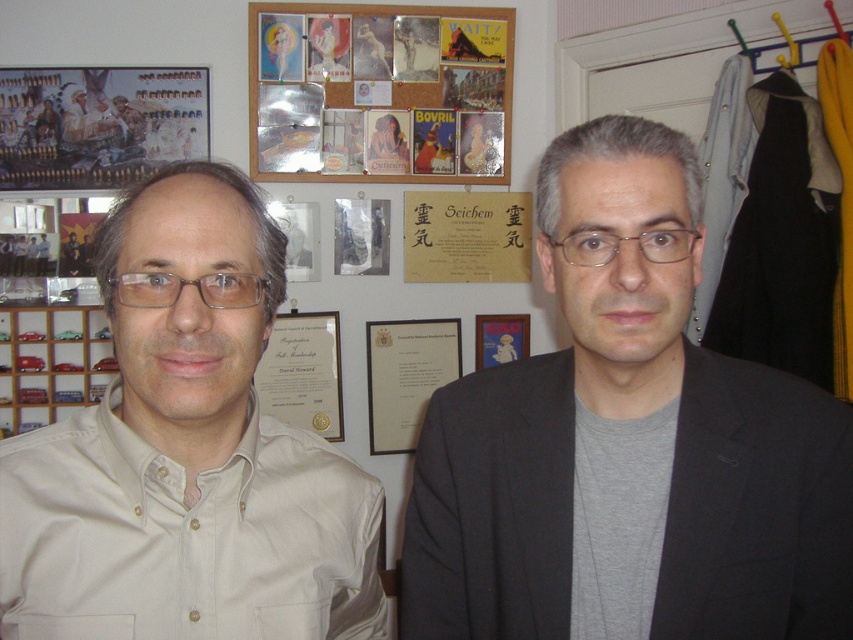
In the scene shown: Please provide the 2D coordinates of the gray matte suit at center in the image. The coordinates should be in the format of a point with two decimal places, like point 0.5,0.5.

The gray matte suit at center is located at point (x=627, y=442).